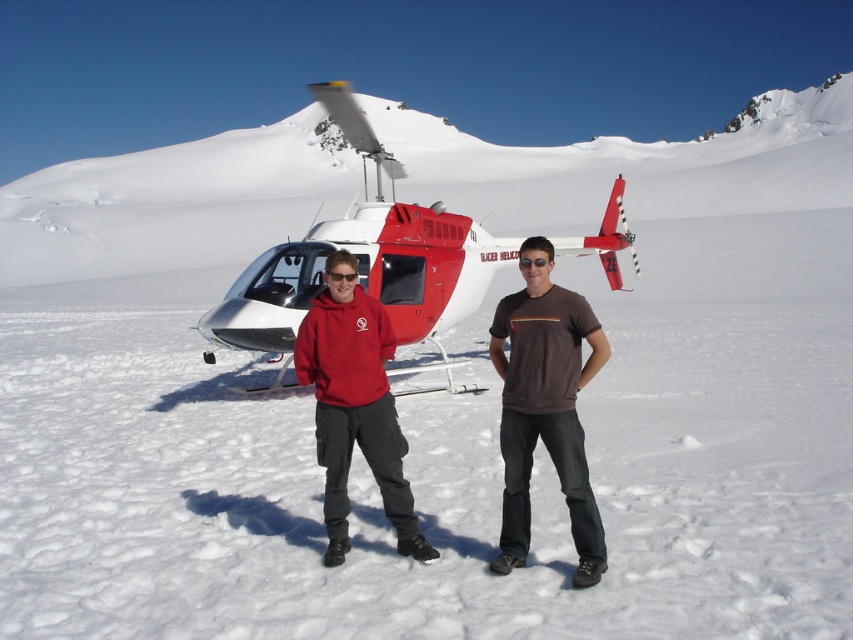
You are standing at the point labeled point (378, 220) and want to walk to the point labeled point (601, 563). Which direction should you face to walk directly towards your destination?

To walk directly towards point (601, 563) from point (378, 220), you should face towards the direction of point (601, 563). Since point (378, 220) is behind point (601, 563), you need to walk forward towards the direction of point (601, 563).

You are a photographer trying to capture a photo of the two people in the snowy landscape. You notice two points marked in the image. The first point is at coordinate point [494,260] and the second is at point [323,422]. Which point is closer to the camera?

Point [323,422] is closer to the camera because the description states that point [494,260] is behind point [323,422].